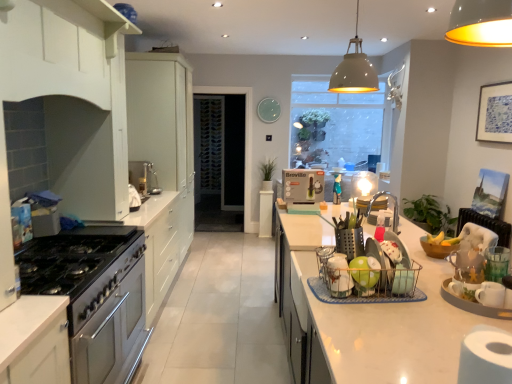
Question: Is blue paper picture frame at upper right directly adjacent to white wood shelf at upper center, which ranks as the first cabinetry in front-to-back order?

Choices:
 (A) no
 (B) yes

Answer: (A)

Question: Can we say blue paper picture frame at upper right lies outside white wood shelf at upper center, which ranks as the first cabinetry in front-to-back order?

Choices:
 (A) yes
 (B) no

Answer: (A)

Question: Is blue paper picture frame at upper right shorter than white wood shelf at upper center, which appears as the 3th cabinetry when viewed from the back?

Choices:
 (A) yes
 (B) no

Answer: (B)

Question: From a real-world perspective, is blue paper picture frame at upper right over white wood shelf at upper center, which ranks as the first cabinetry in front-to-back order?

Choices:
 (A) no
 (B) yes

Answer: (A)

Question: From a real-world perspective, does blue paper picture frame at upper right sit lower than white wood shelf at upper center, which ranks as the first cabinetry in front-to-back order?

Choices:
 (A) yes
 (B) no

Answer: (A)

Question: Can you confirm if blue paper picture frame at upper right is smaller than white wood shelf at upper center, which appears as the 3th cabinetry when viewed from the back?

Choices:
 (A) yes
 (B) no

Answer: (A)

Question: Are white matte pendant light at upper center and matte white light bulb at center, the fourth appliance viewed from the left, far apart?

Choices:
 (A) no
 (B) yes

Answer: (B)

Question: Can you confirm if white matte pendant light at upper center is bigger than matte white light bulb at center, marked as the 1th appliance in a right-to-left arrangement?

Choices:
 (A) yes
 (B) no

Answer: (A)

Question: Would you say matte white light bulb at center, which is counted as the first appliance, starting from the back, is part of white matte pendant light at upper center's contents?

Choices:
 (A) no
 (B) yes

Answer: (A)

Question: Is white matte pendant light at upper center further to camera compared to matte white light bulb at center, which is counted as the first appliance, starting from the back?

Choices:
 (A) no
 (B) yes

Answer: (A)

Question: Considering the relative sizes of white matte pendant light at upper center and matte white light bulb at center, marked as the 1th appliance in a right-to-left arrangement, in the image provided, is white matte pendant light at upper center shorter than matte white light bulb at center, marked as the 1th appliance in a right-to-left arrangement,?

Choices:
 (A) yes
 (B) no

Answer: (B)

Question: Is white matte pendant light at upper center outside of matte white light bulb at center, which is counted as the first appliance, starting from the back?

Choices:
 (A) yes
 (B) no

Answer: (A)

Question: Considering the relative positions of white glossy countertop at right and green matte plant at center, the 1th plant positioned from the left, in the image provided, is white glossy countertop at right behind green matte plant at center, the 1th plant positioned from the left,?

Choices:
 (A) yes
 (B) no

Answer: (B)